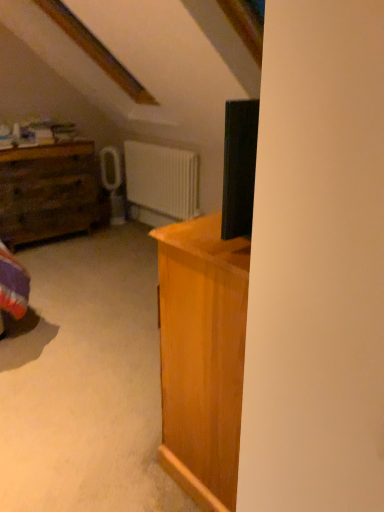
Question: Should I look upward or downward to see rustic wood chest of drawers at left?

Choices:
 (A) down
 (B) up

Answer: (B)

Question: Can you confirm if rustic wood chest of drawers at left is shorter than white matte radiator at center?

Choices:
 (A) yes
 (B) no

Answer: (B)

Question: Is the depth of rustic wood chest of drawers at left less than that of white matte radiator at center?

Choices:
 (A) yes
 (B) no

Answer: (A)

Question: Is rustic wood chest of drawers at left smaller than white matte radiator at center?

Choices:
 (A) yes
 (B) no

Answer: (B)

Question: From the image's perspective, is rustic wood chest of drawers at left on top of white matte radiator at center?

Choices:
 (A) yes
 (B) no

Answer: (B)

Question: Does rustic wood chest of drawers at left have a greater width compared to white matte radiator at center?

Choices:
 (A) yes
 (B) no

Answer: (A)

Question: From a real-world perspective, is rustic wood chest of drawers at left located higher than white matte radiator at center?

Choices:
 (A) no
 (B) yes

Answer: (A)

Question: Considering the relative sizes of white matte radiator at center and rustic wood chest of drawers at left in the image provided, is white matte radiator at center bigger than rustic wood chest of drawers at left?

Choices:
 (A) yes
 (B) no

Answer: (B)

Question: Is the position of white matte radiator at center more distant than that of rustic wood chest of drawers at left?

Choices:
 (A) no
 (B) yes

Answer: (B)

Question: Is rustic wood chest of drawers at left at the back of white matte radiator at center?

Choices:
 (A) no
 (B) yes

Answer: (A)

Question: Does white matte radiator at center have a greater width compared to rustic wood chest of drawers at left?

Choices:
 (A) no
 (B) yes

Answer: (A)

Question: Is white matte radiator at center placed right next to rustic wood chest of drawers at left?

Choices:
 (A) yes
 (B) no

Answer: (B)

Question: Considering the relative positions of white matte radiator at center and rustic wood chest of drawers at left in the image provided, is white matte radiator at center to the right of rustic wood chest of drawers at left from the viewer's perspective?

Choices:
 (A) yes
 (B) no

Answer: (A)

Question: Considering the positions of white matte radiator at center and rustic wood chest of drawers at left in the image, is white matte radiator at center bigger or smaller than rustic wood chest of drawers at left?

Choices:
 (A) big
 (B) small

Answer: (B)